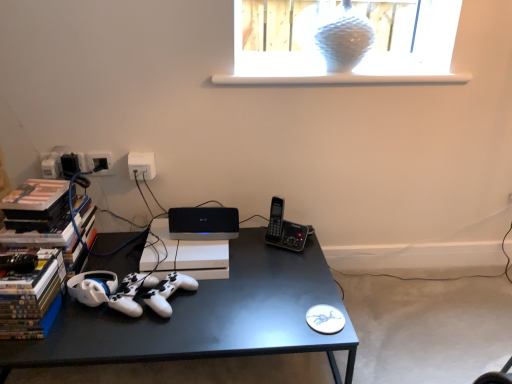
Question: From the image's perspective, is black plastic phone at right above or below white plastic electrical outlet at upper center?

Choices:
 (A) above
 (B) below

Answer: (B)

Question: Is black plastic phone at right spatially inside white plastic electrical outlet at upper center, or outside of it?

Choices:
 (A) outside
 (B) inside

Answer: (A)

Question: Estimate the real-world distances between objects in this image. Which object is closer to the black matte desk at center?

Choices:
 (A) white plastic electrical outlet at upper center
 (B) hardcover books at left
 (C) black plastic phone at right
 (D) white matte window sill at upper center
 (E) transparent textured glass vase at upper center

Answer: (C)

Question: Which object is positioned closest to the transparent textured glass vase at upper center?

Choices:
 (A) white matte game controller at center
 (B) white plastic electrical outlet at upper center
 (C) white matte window sill at upper center
 (D) black matte desk at center
 (E) hardcover books at left

Answer: (C)